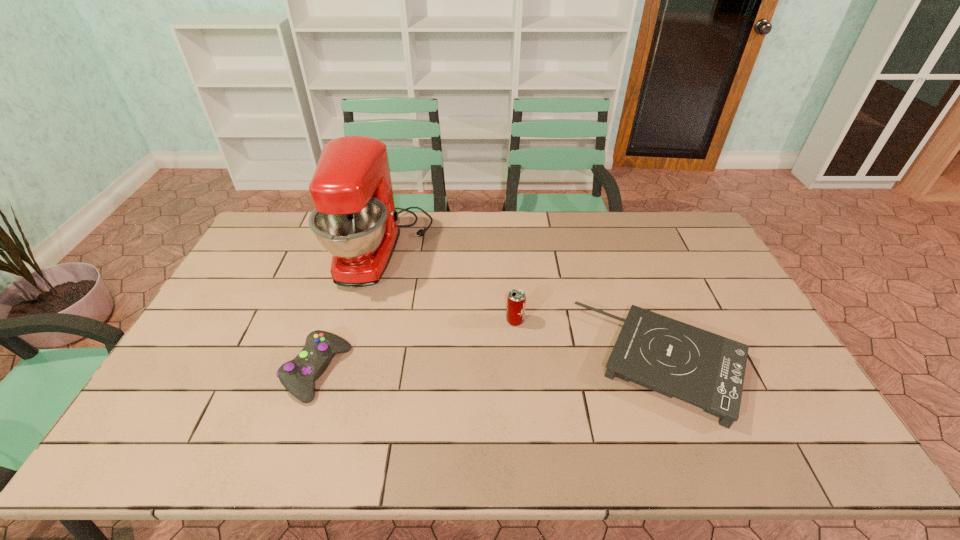
Where is `kitchen mixer`? Image resolution: width=960 pixels, height=540 pixels. kitchen mixer is located at coordinates (354, 219).

Where is `the farthest object`? the farthest object is located at coordinates (354, 219).

Where is `beer can`? Image resolution: width=960 pixels, height=540 pixels. beer can is located at coordinates pyautogui.click(x=516, y=300).

Image resolution: width=960 pixels, height=540 pixels. Find the location of `the third object from left to right`. the third object from left to right is located at coordinates (516, 300).

Identify the location of control. (298, 375).

In order to click on the rightmost object in this screenshot , I will do `click(675, 359)`.

Where is `hotplate`? The width and height of the screenshot is (960, 540). hotplate is located at coordinates (675, 359).

Find the location of a particular element. vacant region located on the front-facing side of the tallest object is located at coordinates (483, 250).

Identify the location of blank space located on the right of the third shortest object. (551, 321).

I want to click on free location located on the back of the second shortest object, so click(353, 262).